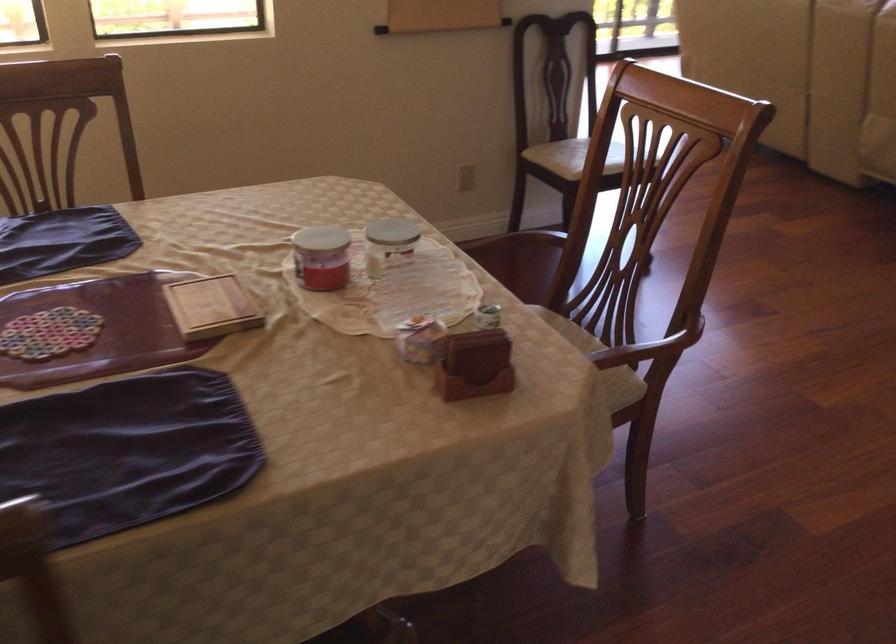
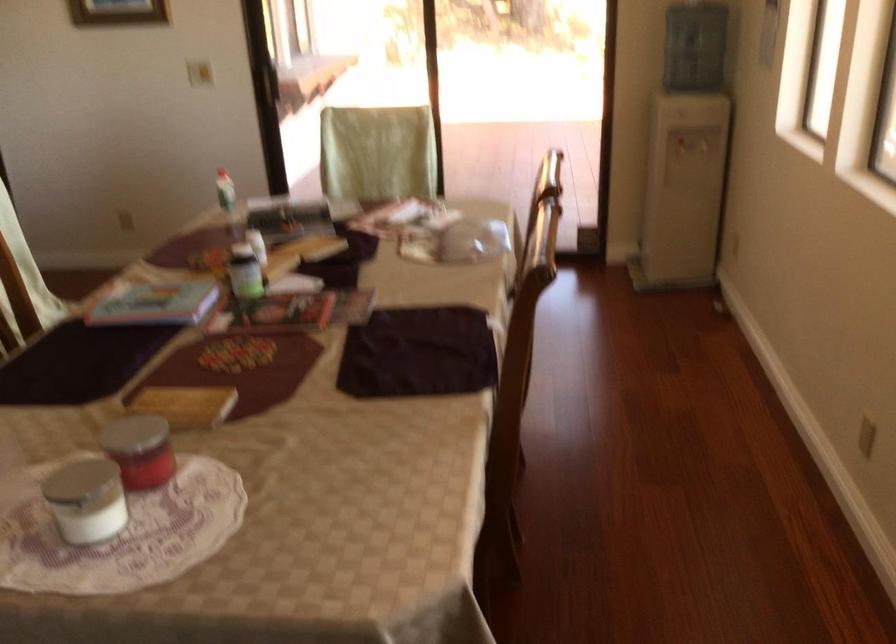
The point at (x=407, y=232) is marked in the first image. Where is the corresponding point in the second image?

(85, 500)